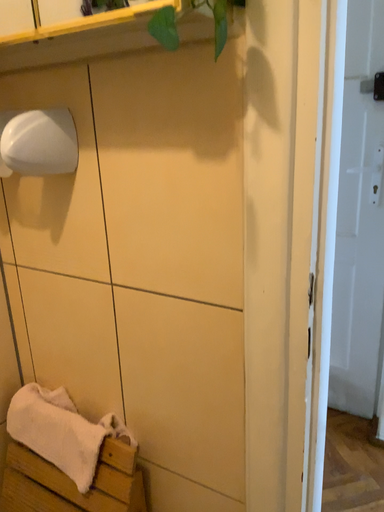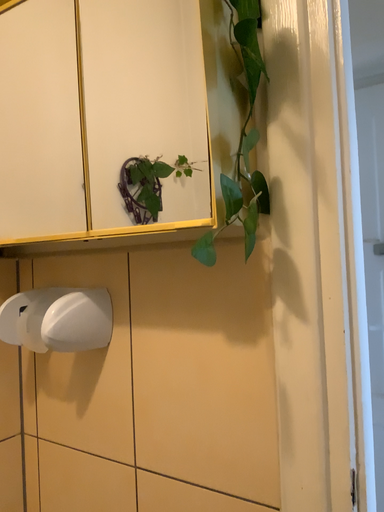
Question: Which way did the camera rotate in the video?

Choices:
 (A) rotated downward
 (B) rotated upward

Answer: (B)